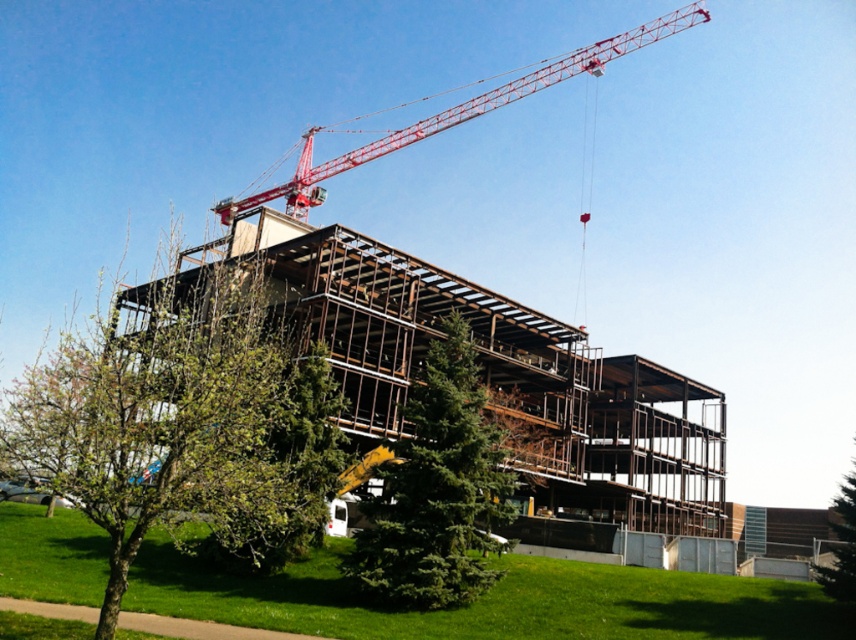
You are a construction worker standing at the base of the green evergreen tree at center. You need to move a heavy beam to the red metallic crane at upper center. The beam is 70 meters long. Can you safely move the beam horizontally without it touching the ground?

The distance between the green evergreen tree at center and the red metallic crane at upper center is 69.65 meters. Since the beam is 70 meters long, it would extend beyond the required distance, allowing safe horizontal movement without touching the ground.

You are a construction worker standing at the base of the red metallic crane at upper center. You need to move a large steel beam horizontally from the crane to a storage area near the green textured tree at lower right. Considering the potential width of the crane, will the beam fit through the space between the crane and the tree without bending?

The red metallic crane at upper center might be wider than the green textured tree at lower right. If the crane is indeed wider, the space between them may be insufficient for the beam to pass straight through without bending. However, if the crane is narrower, there might be enough space. Without exact measurements, it is uncertain whether the beam can fit without bending.

Looking at this image, you are an architect standing on the construction site and want to ensure the green leafy tree at center is visible from the second floor windows of the building. Given the current position of the red metallic crane at upper center, can you confirm if the tree is obstructed by the crane?

The green leafy tree at center is below the red metallic crane at upper center, so the crane is positioned above the tree. This means the crane could potentially block the view of the tree from the second floor windows if the crane remains in its current position.